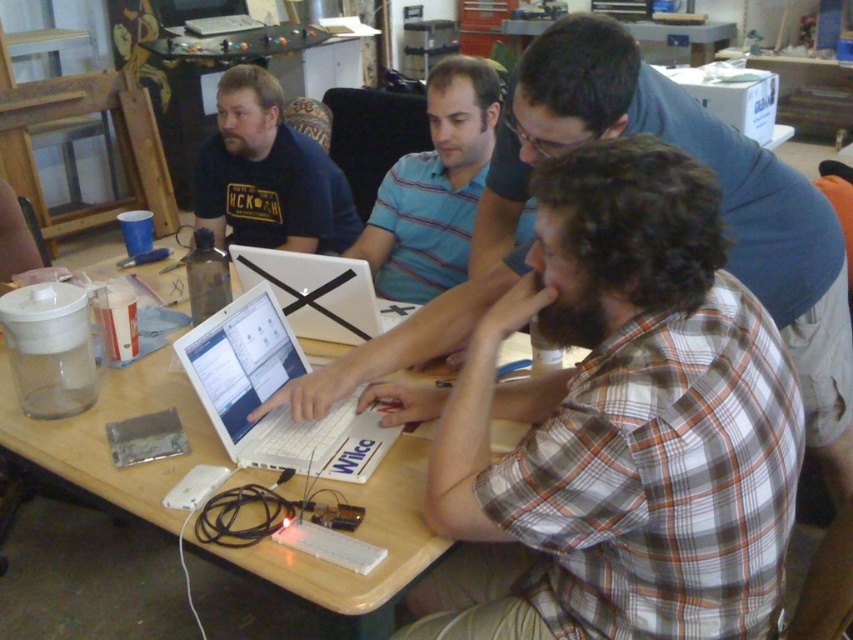
You are a technician trying to determine which laptop is more suitable for a presentation. The white plastic laptop at center has a taller screen, while the white matte laptop at center has a nonreflective surface. Which laptop would you choose if you want to avoid glare from lights?

The white matte laptop at center has a nonreflective surface, so it would be better for avoiding glare during the presentation.

You are standing at the point labeled point (236, 273) and want to move to the point labeled point (479, 116). Is the path directly between these two points clear of any obstacles?

The path between point (479, 116) and point (236, 273) is clear since there are no objects mentioned in the scene description that would block the path.

You are a visitor in the workshop and want to see both the white plastic laptop at center and the white matte laptop at center. Which one is positioned lower on the table?

Answer: The white plastic laptop at center is positioned lower on the table than the white matte laptop at center.